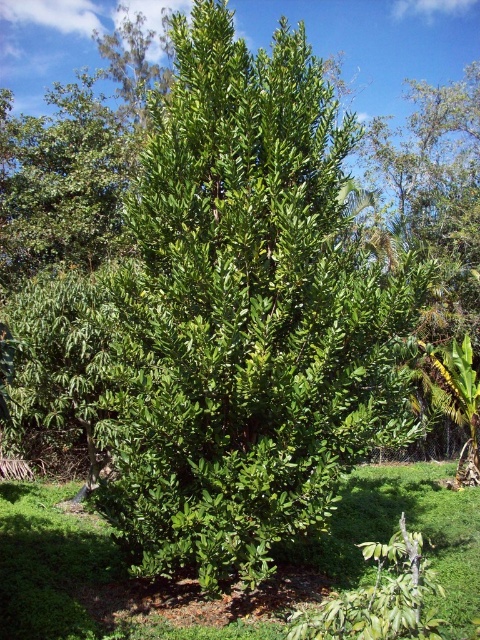
You are standing in a garden and see the green leafy grass at center and the green leafy tree at upper left. Which object is positioned lower in the image?

The green leafy grass at center is positioned lower than the green leafy tree at upper left in the image.

From the picture: You are standing at the base of the tree and want to place a 10 foot long bench between the green leafy grass at center and another object. Is there enough space?

The distance between the green leafy grass at center and the other object is 14.77 feet, so yes, the 10 foot long bench can be placed between them as there is sufficient space.

You are standing in a garden and see the green leafy bush at center and the green leafy grass at center. Which one is positioned to the right side?

The green leafy bush at center is positioned to the right of the green leafy grass at center.